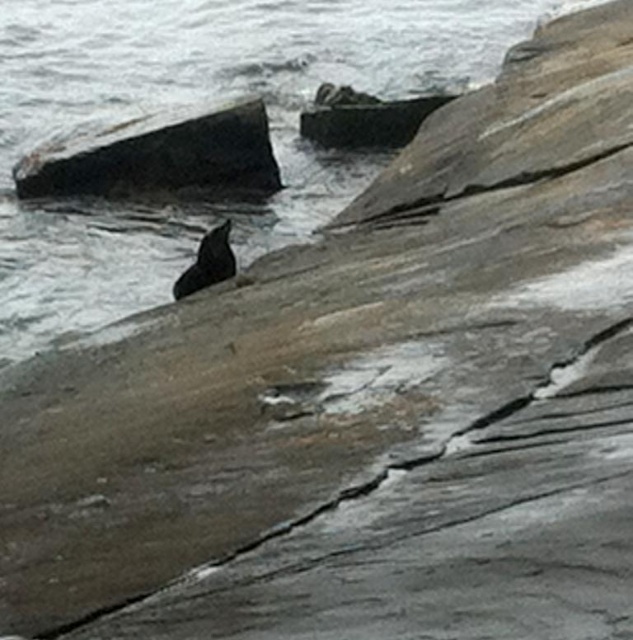
You are standing on the rocky shoreline and want to move from point A to point B. Given that point A is at coordinates point (154, 177) and point B is at coordinates point (192, 275), which point is closer to you when you are facing the shoreline?

Point (154, 177) is closer to you since it is further to the viewer than point (192, 275).

You are a geologist examining the coastal scene. You need to locate the smooth gray rock at upper center. According to the coordinates provided, where exactly is it positioned in the image?

A: The smooth gray rock at upper center is located at point coordinates of 0.186 on the x axis and 0.577 on the y axis.

You are standing on the rocky shoreline and want to place a small decorative statue exactly at point [160,154]. What type of rock will the statue be placed on?

The statue will be placed on the smooth dark gray rock at upper left located at point 0.253, 0.253.